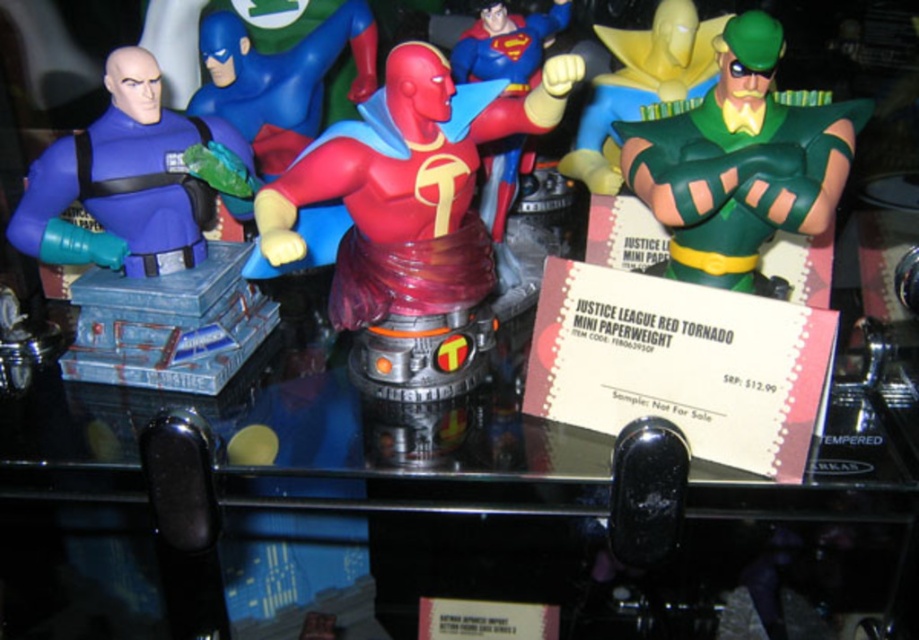
You are organizing a Justice League exhibit and need to place both the clear glass table at center and the green rubber mask at upper right on a display stand. Which object should you place first if you want to arrange them from largest to smallest?

The clear glass table at center should be placed first because it is bigger than the green rubber mask at upper right.